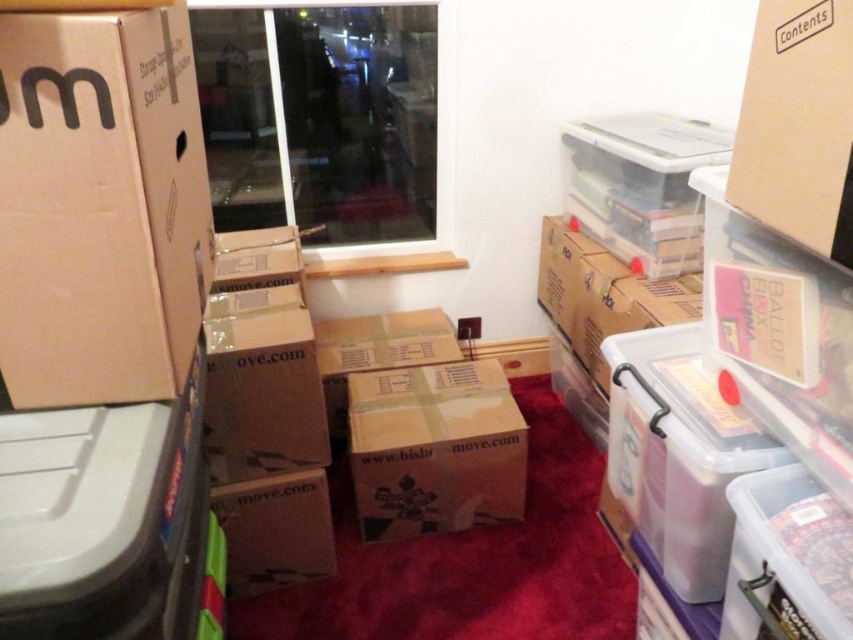
Question: Which point is farther to the camera?

Choices:
 (A) brown cardboard box at center
 (B) matte cardboard box at left

Answer: (A)

Question: Is matte cardboard box at left behind brown cardboard box at center?

Choices:
 (A) yes
 (B) no

Answer: (B)

Question: Which point is farther from the camera taking this photo?

Choices:
 (A) pos(461,440)
 (B) pos(3,212)

Answer: (A)

Question: Considering the relative positions of matte cardboard box at left and brown cardboard box at center in the image provided, where is matte cardboard box at left located with respect to brown cardboard box at center?

Choices:
 (A) above
 (B) below

Answer: (A)

Question: Which point appears closest to the camera in this image?

Choices:
 (A) (456, 486)
 (B) (138, 308)

Answer: (B)

Question: Does matte cardboard box at left come behind brown cardboard box at center?

Choices:
 (A) no
 (B) yes

Answer: (A)